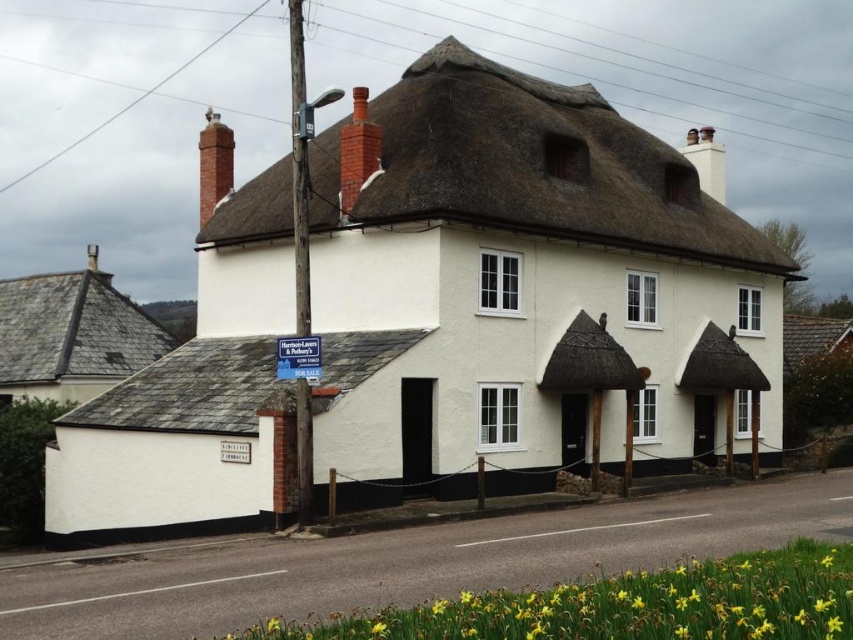
You are a painter standing at the base of the road. You want to paint the white thatched roof cottage at center and the thatched roof at upper center. Which one should you focus on first if you want to paint the smaller one first?

The white thatched roof cottage at center has a smaller size compared to the thatched roof at upper center, so you should focus on painting the white thatched roof cottage at center first.

You are a gardener planning to plant more flowers next to the yellow matte daffodil at lower right and the gray slate roof at lower left. Since the daffodil is smaller, which object should you place the new flowers closer to for better visibility?

The yellow matte daffodil at lower right has a smaller width compared to the gray slate roof at lower left, so placing new flowers closer to the yellow matte daffodil at lower right would ensure better visibility as they won t be overshadowed by the larger structure.